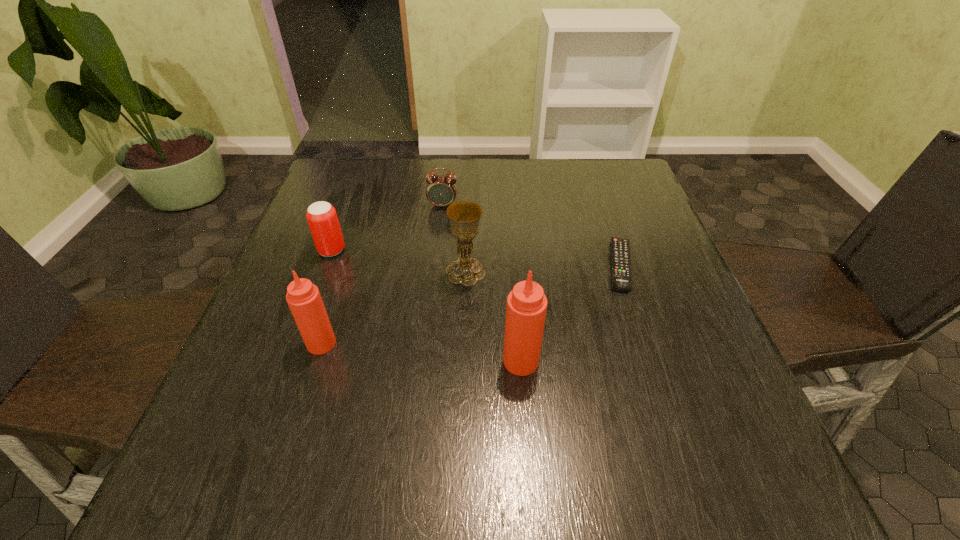
Locate an element on the screen. The height and width of the screenshot is (540, 960). free space between the left Tabasco sauce and the beer can is located at coordinates (326, 297).

In order to click on free space that is in between the tallest object and the shortest object in this screenshot , I will do `click(570, 313)`.

The width and height of the screenshot is (960, 540). I want to click on free point between the farthest object and the tallest object, so click(482, 284).

Where is `unoccupied area between the taller Tabasco sauce and the left Tabasco sauce`? This screenshot has height=540, width=960. unoccupied area between the taller Tabasco sauce and the left Tabasco sauce is located at coordinates (421, 352).

Select which object appears as the second closest to the alarm clock. Please provide its 2D coordinates. Your answer should be formatted as a tuple, i.e. [(x, y)], where the tuple contains the x and y coordinates of a point satisfying the conditions above.

[(322, 218)]

Select which object is the second closest to the fifth object from left to right. Please provide its 2D coordinates. Your answer should be formatted as a tuple, i.e. [(x, y)], where the tuple contains the x and y coordinates of a point satisfying the conditions above.

[(620, 252)]

Find the location of `vacant space that satisfies the following two spatial constraints: 1. on the face of the shortest object; 2. on the right side of the alarm clock`. vacant space that satisfies the following two spatial constraints: 1. on the face of the shortest object; 2. on the right side of the alarm clock is located at coordinates (436, 265).

Identify the location of vacant space that satisfies the following two spatial constraints: 1. on the face of the farthest object; 2. on the right side of the rightmost object. (436, 265).

You are a GUI agent. You are given a task and a screenshot of the screen. Output one action in this format:
    pyautogui.click(x=<x>, y=<y>)
    Task: Click on the vacant space that satisfies the following two spatial constraints: 1. on the face of the farthest object; 2. on the right side of the tallest object
    The width and height of the screenshot is (960, 540).
    Given the screenshot: What is the action you would take?
    pyautogui.click(x=426, y=361)

You are a GUI agent. You are given a task and a screenshot of the screen. Output one action in this format:
    pyautogui.click(x=<x>, y=<y>)
    Task: Click on the free spot that satisfies the following two spatial constraints: 1. on the face of the alarm clock; 2. on the right side of the chalice
    This screenshot has width=960, height=540.
    Given the screenshot: What is the action you would take?
    pyautogui.click(x=436, y=272)